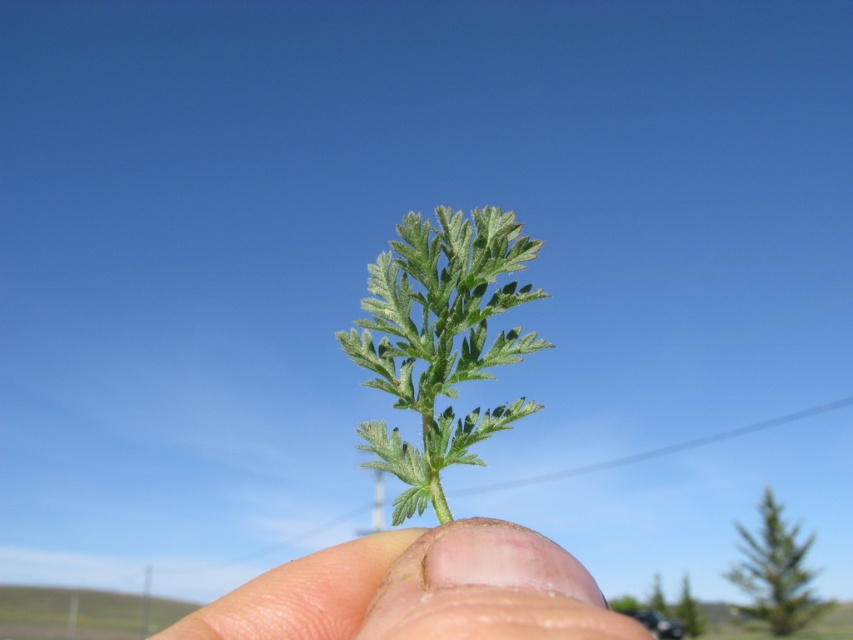
Does fleshy skin at center have a lesser width compared to green fuzzy leaf at center?

Incorrect, fleshy skin at center's width is not less than green fuzzy leaf at center's.

Who is lower down, fleshy skin at center or green fuzzy leaf at center?

fleshy skin at center is lower down.

I want to click on fleshy skin at center, so (x=419, y=592).